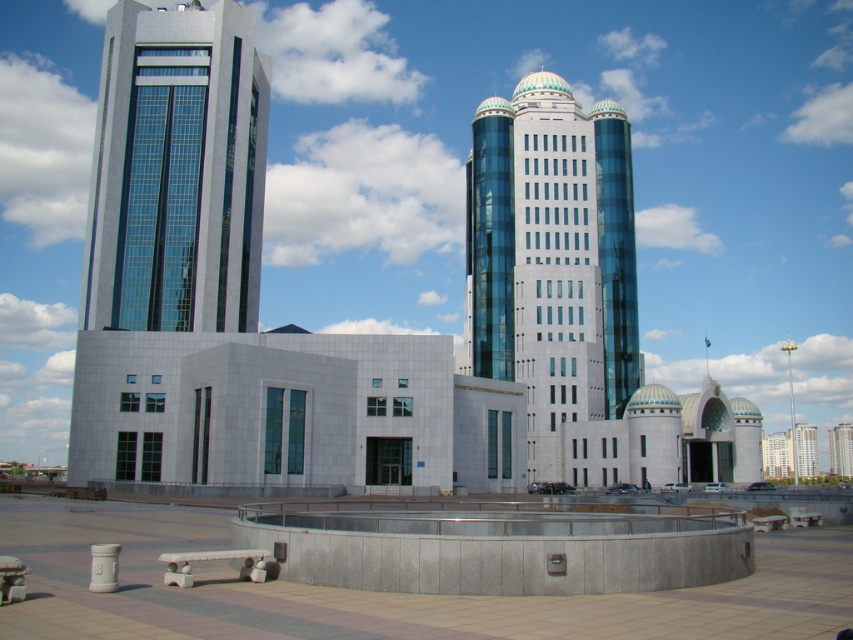
Does matte glass tower at left have a greater height compared to glassy blue skyscraper at center?

Incorrect, matte glass tower at left's height is not larger of glassy blue skyscraper at center's.

Which is more to the left, matte glass tower at left or glassy blue skyscraper at center?

matte glass tower at left

This screenshot has width=853, height=640. Describe the element at coordinates (177, 172) in the screenshot. I see `matte glass tower at left` at that location.

Locate an element on the screen. matte glass tower at left is located at coordinates (177, 172).